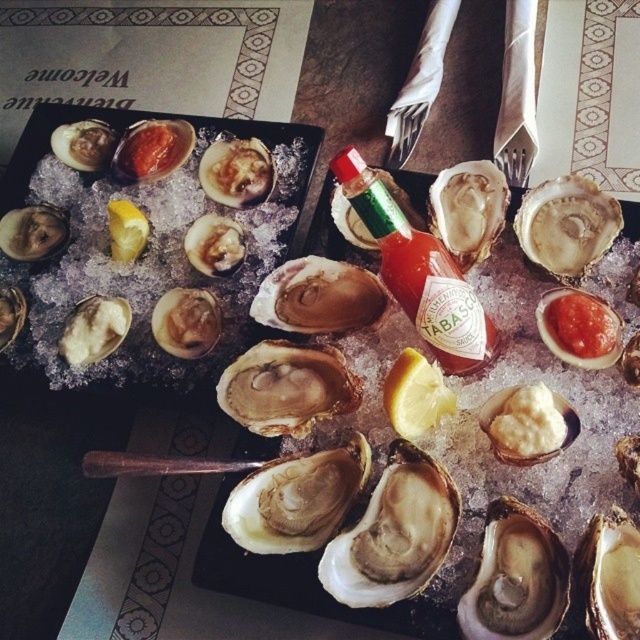
Question: Which point appears closest to the camera in this image?

Choices:
 (A) (376, 186)
 (B) (611, 326)
 (C) (365, 168)

Answer: (C)

Question: Does green glass tabasco bottle at center appear on the right side of red glossy tomato sauce at center?

Choices:
 (A) no
 (B) yes

Answer: (A)

Question: Observing the image, what is the correct spatial positioning of green glass tabasco sauce bottle at center in reference to white creamy mashed potato at center?

Choices:
 (A) above
 (B) below

Answer: (A)

Question: Can you confirm if yellow matte lemon at center is bigger than red glossy tomato sauce at center?

Choices:
 (A) yes
 (B) no

Answer: (A)

Question: Which object is positioned closest to the green glass tabasco sauce bottle at center?

Choices:
 (A) white creamy mashed potato at center
 (B) green glass tabasco bottle at center
 (C) yellow matte lemon at center
 (D) red glossy tomato sauce at center

Answer: (B)

Question: Which object is the farthest from the yellow matte lemon at center?

Choices:
 (A) white creamy mashed potato at center
 (B) green glass tabasco sauce bottle at center
 (C) green glass tabasco bottle at center
 (D) red glossy tomato sauce at center

Answer: (D)